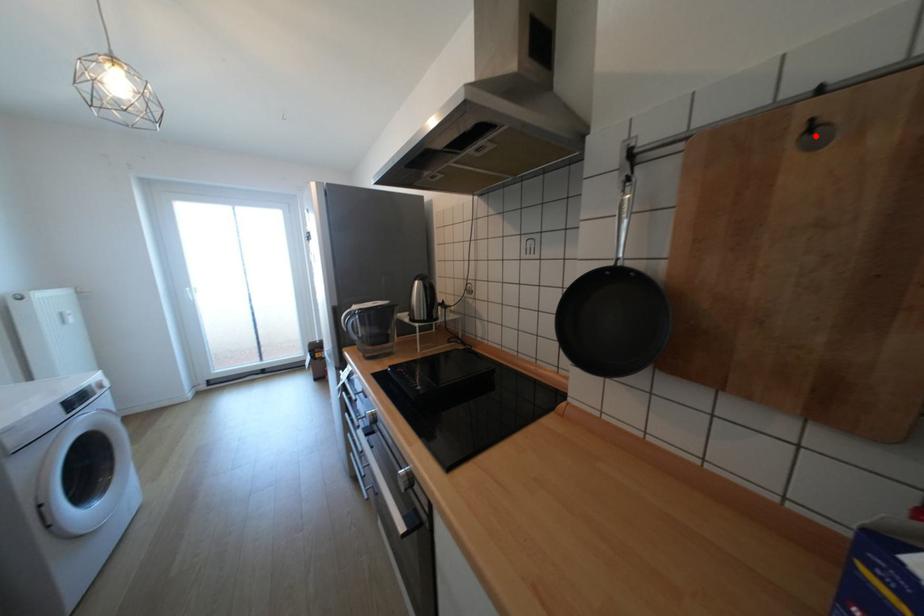
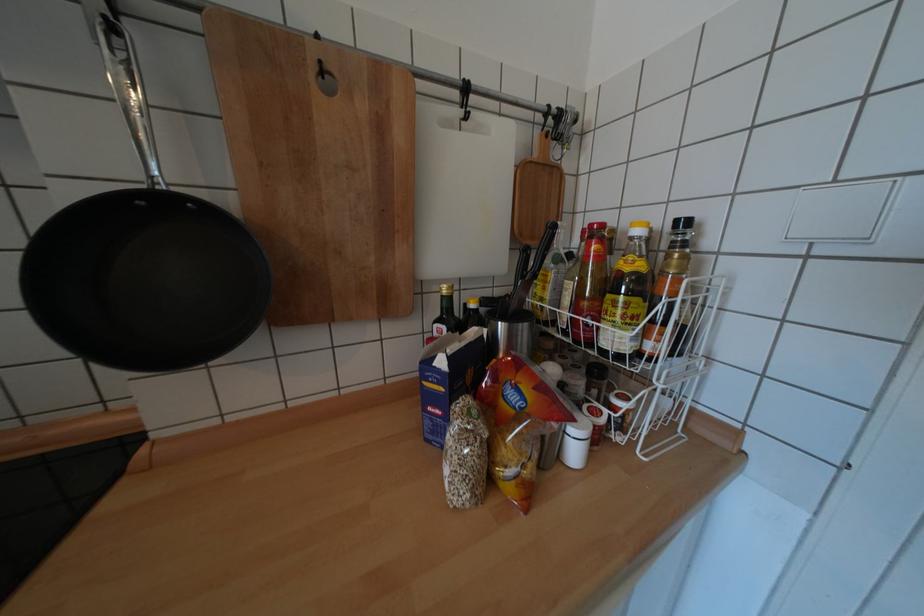
Find the pixel in the second image that matches the highlighted location in the first image.

(330, 79)